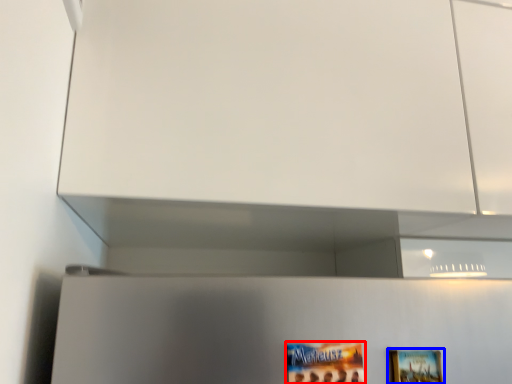
Question: Which point is further to the camera, movie poster (highlighted by a red box) or picture frame (highlighted by a blue box)?

Choices:
 (A) movie poster
 (B) picture frame

Answer: (B)